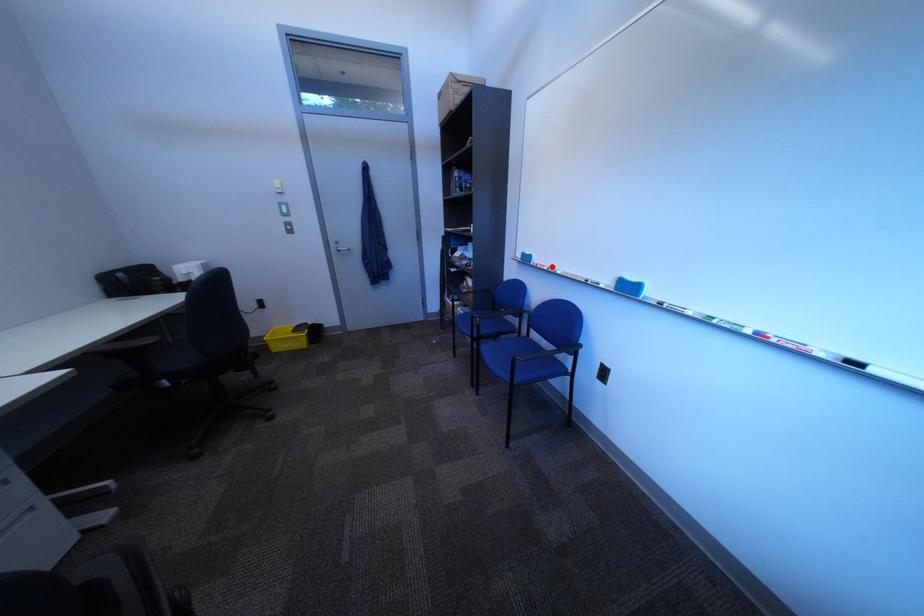
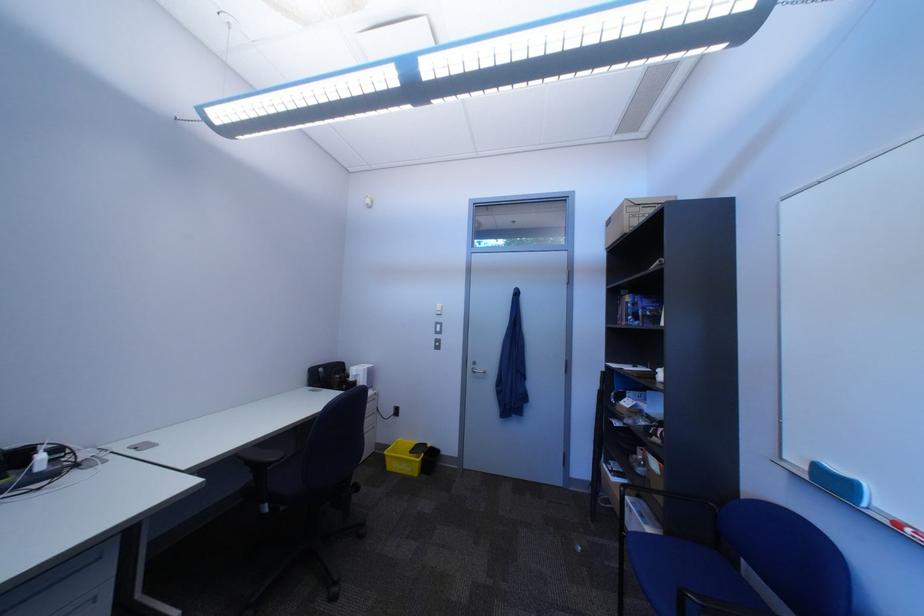
Question: A red point is marked in image1. In image2, is the corresponding 3D point closer to the camera or farther? Reply with the corresponding letter.

Choices:
 (A) The corresponding 3D point is closer.
 (B) The corresponding 3D point is farther.

Answer: (B)